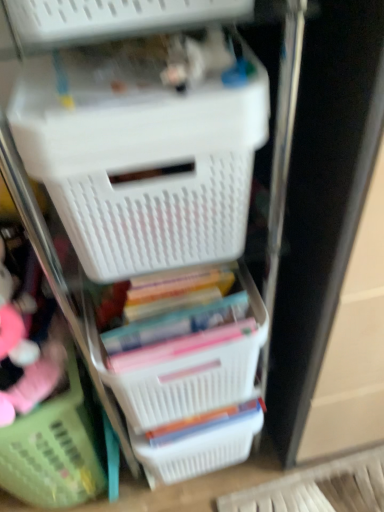
Question: Visually, is white plastic basket at center, which is the second basket in right-to-left order, positioned to the left or to the right of white plastic basket at upper center?

Choices:
 (A) left
 (B) right

Answer: (B)

Question: Is point (172, 411) positioned closer to the camera than point (145, 268)?

Choices:
 (A) closer
 (B) farther

Answer: (B)

Question: Based on their relative distances, which object is farther from the white plastic basket at upper center?

Choices:
 (A) green plastic basket at lower left, the 1th basket from the left
 (B) white plastic basket at lower center, which is the 3th basket from left to right
 (C) white plastic basket at center, which is the second basket in right-to-left order

Answer: (B)

Question: Considering the real-world distances, which object is closest to the white plastic basket at center, which is the second basket in right-to-left order?

Choices:
 (A) white plastic basket at upper center
 (B) green plastic basket at lower left, the 3th basket when ordered from right to left
 (C) white plastic basket at lower center, which is the 3th basket from left to right

Answer: (C)